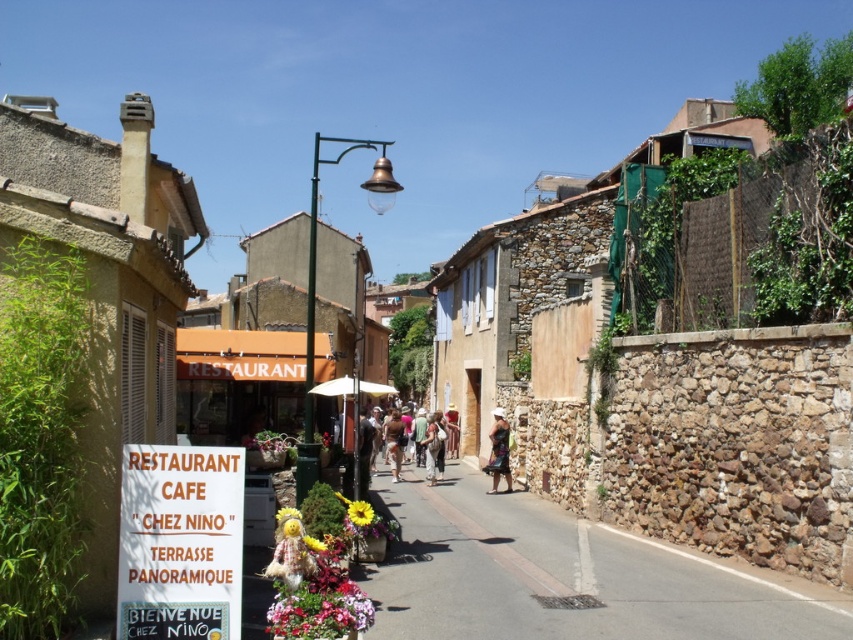
Question: Can you confirm if white paper sign at center is bigger than tan fabric dress at center?

Choices:
 (A) yes
 (B) no

Answer: (B)

Question: Among these objects, which one is nearest to the camera?

Choices:
 (A) multicolored woven bag at center
 (B) brown fabric bag at center

Answer: (A)

Question: Can you confirm if orange fabric restaurant at center is thinner than multicolored woven bag at center?

Choices:
 (A) yes
 (B) no

Answer: (B)

Question: Does orange fabric restaurant at center appear on the left side of tan fabric dress at center?

Choices:
 (A) no
 (B) yes

Answer: (B)

Question: Which object is the farthest from the multicolored woven bag at center?

Choices:
 (A) white paper sign at center
 (B) orange fabric restaurant at center
 (C) smooth stone wall at center

Answer: (A)

Question: Which point is closer to the camera taking this photo?

Choices:
 (A) (415, 433)
 (B) (399, 416)
 (C) (572, 602)

Answer: (C)